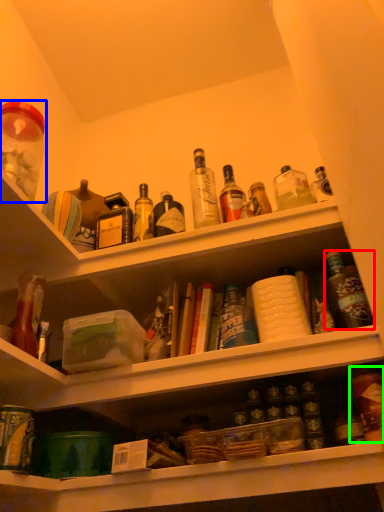
Question: Which object is positioned closest to bottle (highlighted by a red box)? Select from beverage (highlighted by a blue box) and bottle (highlighted by a green box).

Choices:
 (A) beverage
 (B) bottle

Answer: (B)